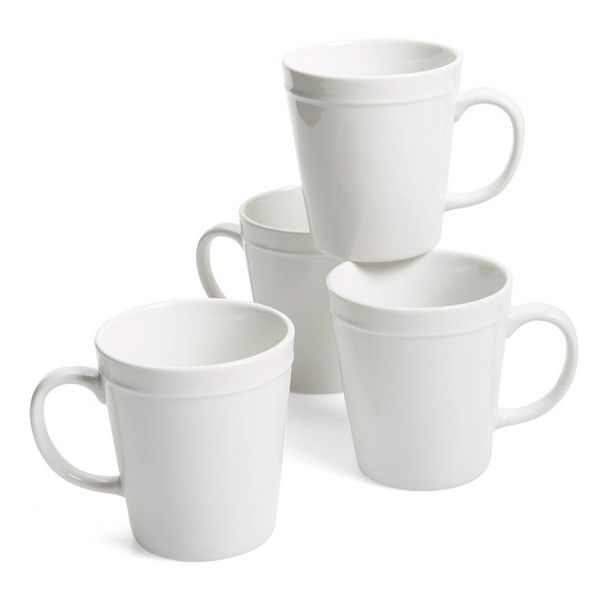
Locate an element on the screen. The width and height of the screenshot is (600, 600). coffee mugs is located at coordinates (240, 395), (288, 300), (352, 256), (396, 350).